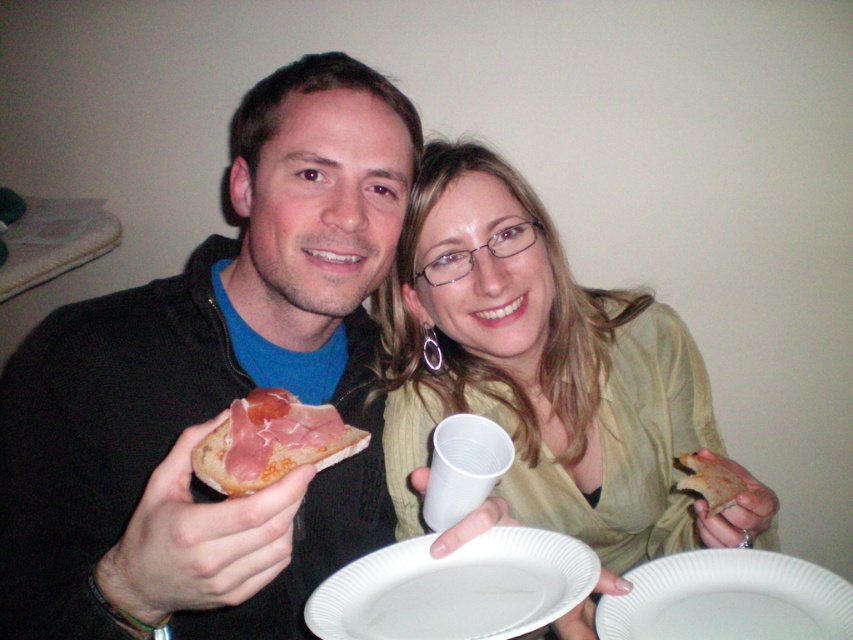
You are a food delivery person who just arrived at a party. You see the white paper plate at lower center and the golden crispy pizza slice at right on a table. The party host tells you to place a new order of a large salad between them. Can the salad fit between the two items without touching either?

The white paper plate at lower center and golden crispy pizza slice at right are 8.39 centimeters apart. Since the salad would require some space to be placed between them, if the distance is sufficient to accommodate the salad plate and its contents without overlapping, it might fit. However, without knowing the exact size of the salad plate, it is difficult to confirm. The distance provided is 8.39 cm, so if the salad plate plus any necessary buffer is less than this, it could work.

You are a photographer trying to capture a clear shot of the matte green blouse at center and the white paper plate at lower center. Based on their positions, which object should you focus on first to ensure both are in frame?

The matte green blouse at center is much taller than the white paper plate at lower center, so you should focus on the matte green blouse at center first to ensure both are in frame.

You are a photographer taking a picture of the white paper plate at lower center and the prosciutto on bread at center. Which object will appear larger in the photo?

The white paper plate at lower center will appear larger in the photo because it is larger in size than the prosciutto on bread at center.